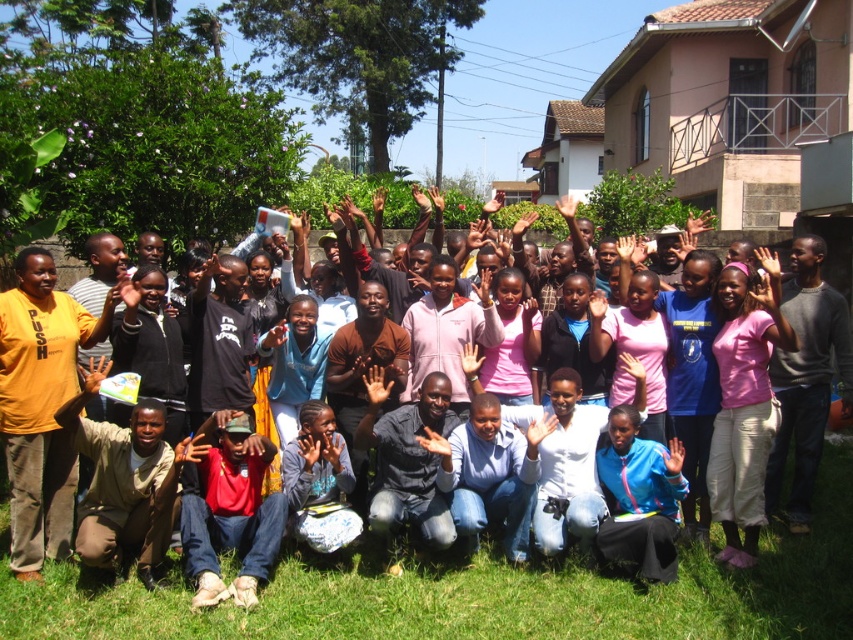
You are standing at the center of the grassy area and want to walk to the point marked as point (90,380). However, there is an obstacle at point (473,356). Will you be able to reach your destination without going around the obstacle?

Yes, you can reach point (90,380) without going around the obstacle because point (90,380) is in front of point (473,356), meaning the obstacle is behind your path to the destination.

You are standing in the middle of the group photo scene and want to step forward onto the green grass at lower center. Based on its position coordinates, can you estimate how far forward you need to move to reach it?

The green grass at lower center is located at coordinates point (482, 595). Since the coordinate system typically ranges from 0 to 1, this means it is positioned approximately 93.0 cm forward and 56.6 cm to the right from your current position. To reach it, you would need to move forward about 93.0 cm.